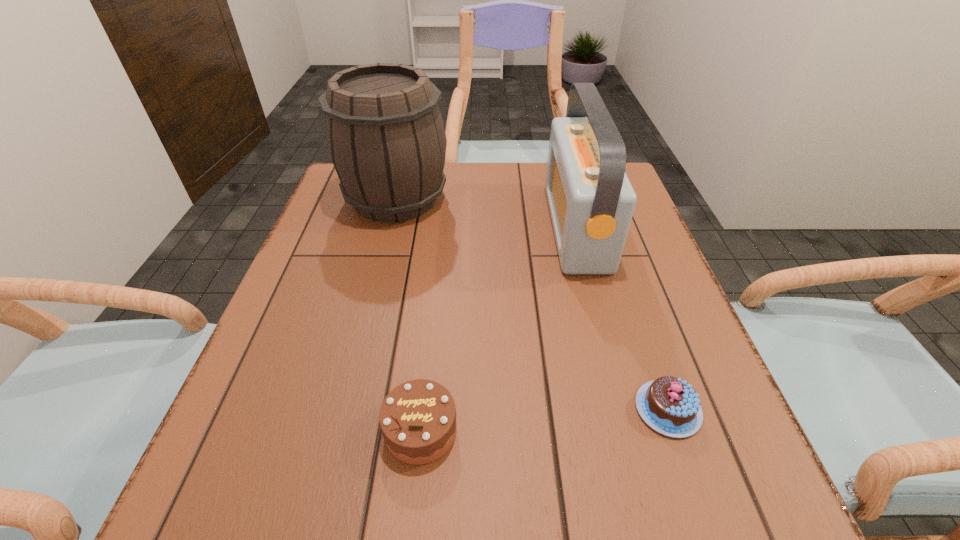
At what (x,y) coordinates should I click in order to perform the action: click on vacant region located on the right of the left chocolate cake. Please return your answer as a coordinate pair (x, y). Looking at the image, I should click on (490, 430).

What are the coordinates of `free space located on the back of the right chocolate cake` in the screenshot? It's located at (623, 279).

Where is `wine bucket at the far edge`? wine bucket at the far edge is located at coordinates (385, 135).

You are a GUI agent. You are given a task and a screenshot of the screen. Output one action in this format:
    pyautogui.click(x=<x>, y=<y>)
    Task: Click on the radio receiver that is positioned at the far edge
    The image size is (960, 540).
    Given the screenshot: What is the action you would take?
    [591, 201]

At what (x,y) coordinates should I click in order to perform the action: click on object located at the left edge. Please return your answer as a coordinate pair (x, y). The height and width of the screenshot is (540, 960). Looking at the image, I should click on (385, 135).

At what (x,y) coordinates should I click in order to perform the action: click on radio receiver that is at the right edge. Please return your answer as a coordinate pair (x, y). Looking at the image, I should click on (591, 201).

This screenshot has height=540, width=960. In order to click on chocolate cake present at the right edge in this screenshot , I will do `click(669, 405)`.

Locate an element on the screen. This screenshot has height=540, width=960. object that is at the far left corner is located at coordinates (385, 135).

Find the location of a particular element. object that is at the far right corner is located at coordinates (591, 201).

At what (x,y) coordinates should I click in order to perform the action: click on vacant space at the far edge of the desktop. Please return your answer as a coordinate pair (x, y). Looking at the image, I should click on (x=472, y=206).